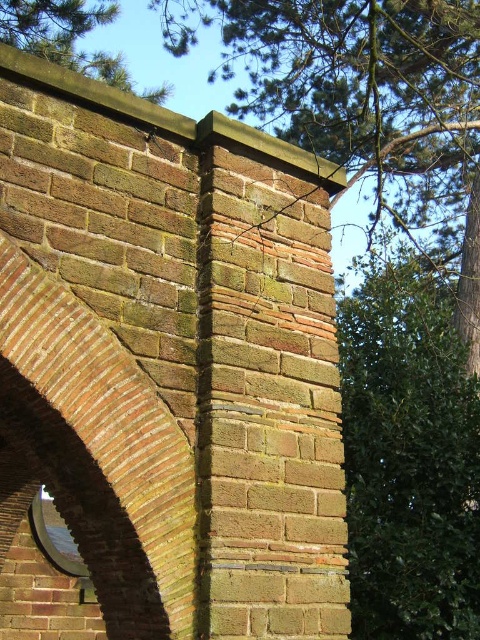
In the scene shown: You are a painter standing at the center of the brick structure. You want to paint both the rustic brick archway at left and the green leafy tree at upper right. If your paintbrush has a maximum reach of 4 meters, can you comfortably paint both objects without moving your position?

The rustic brick archway at left and the green leafy tree at upper right are 4.26 meters apart from each other. Since your paintbrush can only reach up to 4 meters, you cannot comfortably paint both objects without moving your position because the distance between them exceeds your reach.

You are standing in front of the brick structure and notice a specific point marked at coordinates [365,99]. Based on the scene description, where is this point located?

The point at coordinates [365,99] is located on the green leafy tree at upper center.

You are an architect examining the brick structure. You notice the rustic brick archway at left and the green leafy tree at upper right. Which object appears to be closer to the viewer based on their size in the image?

The rustic brick archway at left is smaller than the green leafy tree at upper right, so the tree is farther away and the archway is closer.